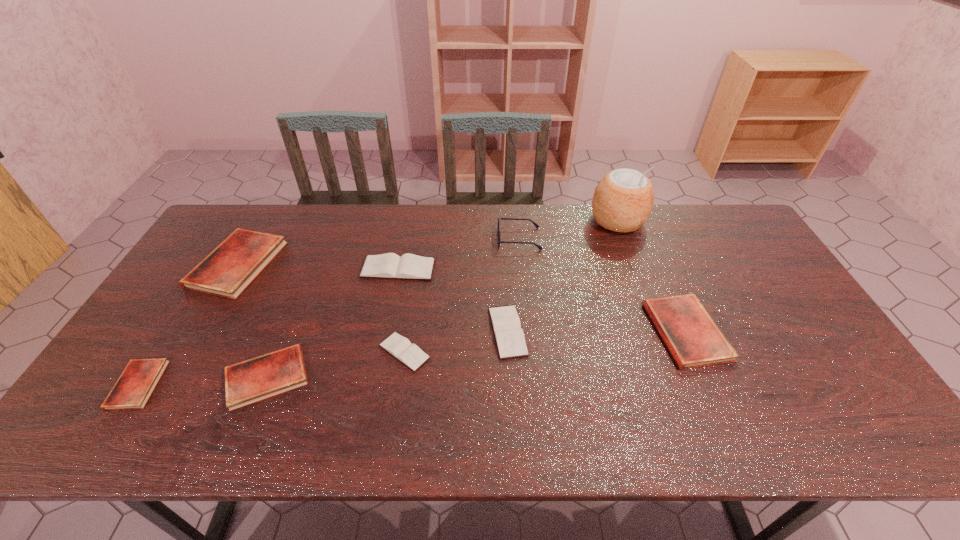
I want to click on unoccupied position between the rightmost brown diary and the third smallest red diary, so click(x=597, y=332).

Locate an element on the screen. This screenshot has height=540, width=960. vacant point located between the second smallest red diary and the rightmost red diary is located at coordinates (476, 354).

The image size is (960, 540). Identify the location of free area in between the smallest red diary and the tallest object. (377, 303).

Locate an element on the screen. This screenshot has width=960, height=540. free space between the smallest red diary and the spectacles is located at coordinates (328, 312).

The width and height of the screenshot is (960, 540). I want to click on free space between the spectacles and the coconut, so click(568, 230).

Select which object is the sixth closest to the smallest brown diary. Please provide its 2D coordinates. Your answer should be formatted as a tuple, i.e. [(x, y)], where the tuple contains the x and y coordinates of a point satisfying the conditions above.

[(132, 390)]

Identify which object is the sixth nearest to the smallest red diary. Please provide its 2D coordinates. Your answer should be formatted as a tuple, i.e. [(x, y)], where the tuple contains the x and y coordinates of a point satisfying the conditions above.

[(498, 232)]

Image resolution: width=960 pixels, height=540 pixels. Find the location of `diary object that ranks as the closest to the farthest brown diary`. diary object that ranks as the closest to the farthest brown diary is located at coordinates (509, 335).

Point out which diary is positioned as the seventh nearest to the tallest object. Please provide its 2D coordinates. Your answer should be formatted as a tuple, i.e. [(x, y)], where the tuple contains the x and y coordinates of a point satisfying the conditions above.

[(132, 390)]

Select which red diary is the third closest to the smallest brown diary. Please provide its 2D coordinates. Your answer should be formatted as a tuple, i.e. [(x, y)], where the tuple contains the x and y coordinates of a point satisfying the conditions above.

[(132, 390)]